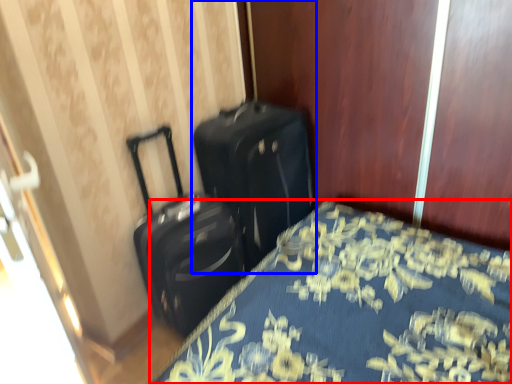
Question: Which object appears farthest to the camera in this image, bed (highlighted by a red box) or suitcase (highlighted by a blue box)?

Choices:
 (A) bed
 (B) suitcase

Answer: (B)